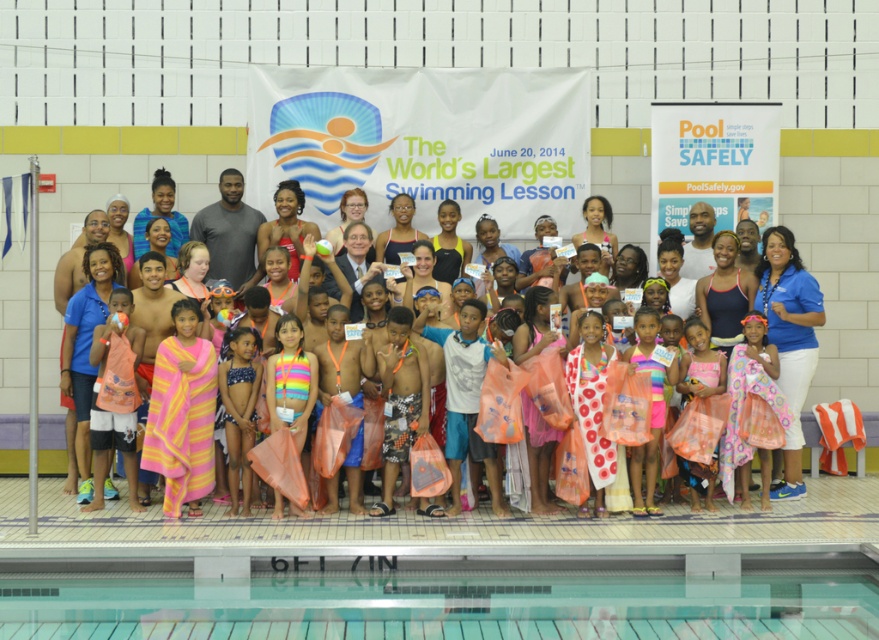
Question: Which of these objects is positioned closest to the multicolored fabric bikini at center?

Choices:
 (A) multicolored towel at center
 (B) clear glass water at lower center

Answer: (A)

Question: Does clear glass water at lower center have a larger size compared to multicolored fabric bikini at center?

Choices:
 (A) yes
 (B) no

Answer: (B)

Question: Which object appears farthest from the camera in this image?

Choices:
 (A) multicolored towel at center
 (B) clear glass water at lower center
 (C) multicolored fabric bikini at center

Answer: (A)

Question: Does multicolored towel at center lie in front of multicolored fabric bikini at center?

Choices:
 (A) no
 (B) yes

Answer: (A)

Question: Considering the real-world distances, which object is farthest from the clear glass water at lower center?

Choices:
 (A) multicolored towel at center
 (B) multicolored fabric bikini at center

Answer: (A)

Question: Does clear glass water at lower center appear under multicolored fabric bikini at center?

Choices:
 (A) no
 (B) yes

Answer: (B)